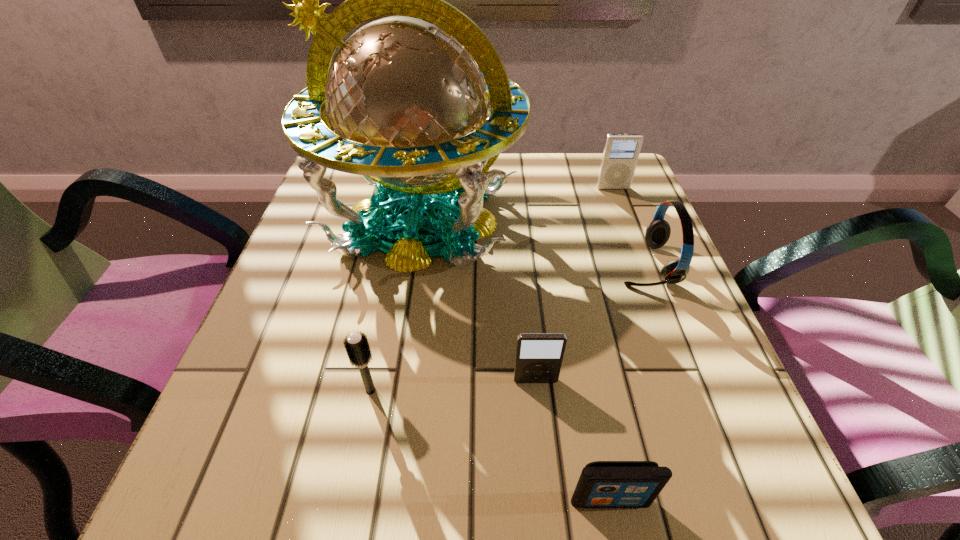
Locate an element on the screen. Image resolution: width=960 pixels, height=540 pixels. free space between the rightmost iPod and the second farthest iPod is located at coordinates (574, 285).

At what (x,y) coordinates should I click in order to perform the action: click on vacant space that is in between the nearest object and the second nearest iPod. Please return your answer as a coordinate pair (x, y). Image resolution: width=960 pixels, height=540 pixels. Looking at the image, I should click on (573, 440).

Where is `free space between the hairbrush and the tallest object`? free space between the hairbrush and the tallest object is located at coordinates (396, 305).

Locate an element on the screen. The width and height of the screenshot is (960, 540). vacant region between the headset and the second tallest iPod is located at coordinates (590, 323).

You are a GUI agent. You are given a task and a screenshot of the screen. Output one action in this format:
    pyautogui.click(x=<x>, y=<y>)
    Task: Click on the vacant space in between the globe and the hairbrush
    The height and width of the screenshot is (540, 960).
    Given the screenshot: What is the action you would take?
    pyautogui.click(x=396, y=305)

Locate an element on the screen. The height and width of the screenshot is (540, 960). unoccupied area between the rightmost iPod and the nearest object is located at coordinates (612, 344).

At what (x,y) coordinates should I click in order to perform the action: click on vacant space that's between the headset and the shortest object. Please return your answer as a coordinate pair (x, y). This screenshot has width=960, height=540. Looking at the image, I should click on (628, 382).

Locate which object ranks fourth in proximity to the hairbrush. Please provide its 2D coordinates. Your answer should be formatted as a tuple, i.e. [(x, y)], where the tuple contains the x and y coordinates of a point satisfying the conditions above.

[(657, 234)]

Identify the location of object that is the closest to the hairbrush. (405, 102).

Where is `iPod object that ranks as the second closest to the nearest iPod`? Image resolution: width=960 pixels, height=540 pixels. iPod object that ranks as the second closest to the nearest iPod is located at coordinates (621, 152).